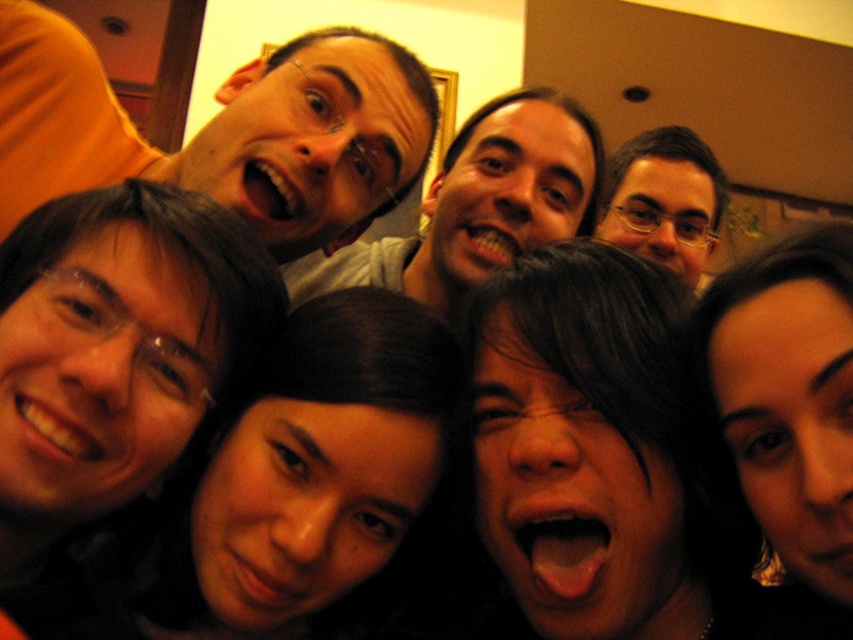
Identify the location of matte black hair at upper left. This screenshot has height=640, width=853. (222, 131).

Which is in front, point (24, 145) or point (637, 218)?

Point (24, 145) is in front.

Where is `matte black hair at upper left`? This screenshot has width=853, height=640. matte black hair at upper left is located at coordinates (222, 131).

Is matte black hair at upper left below matte gray shirt at center?

No, matte black hair at upper left is not below matte gray shirt at center.

Is matte black hair at upper left above matte gray shirt at center?

Correct, matte black hair at upper left is located above matte gray shirt at center.

At what (x,y) coordinates should I click in order to perform the action: click on matte black hair at upper left. Please return your answer as a coordinate pair (x, y). This screenshot has height=640, width=853. Looking at the image, I should click on (222, 131).

Who is more distant from viewer, (x=556, y=200) or (x=680, y=259)?

Positioned behind is point (x=680, y=259).

Does matte gray shirt at center have a smaller size compared to matte black glasses at upper center?

Incorrect, matte gray shirt at center is not smaller in size than matte black glasses at upper center.

Is point (490, 115) closer to camera compared to point (694, 140)?

Yes, it is.

Locate an element on the screen. The width and height of the screenshot is (853, 640). matte gray shirt at center is located at coordinates (480, 204).